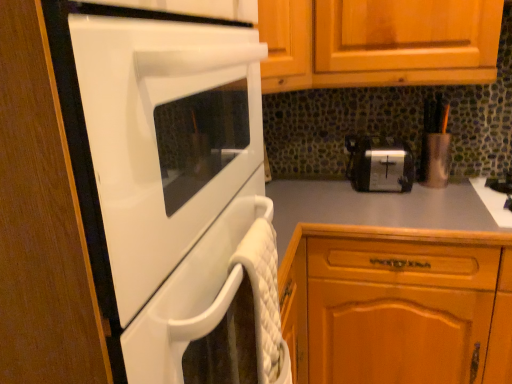
Question: Can you confirm if black matte gas stove at right is wider than white glossy oven at left?

Choices:
 (A) no
 (B) yes

Answer: (A)

Question: Does black matte gas stove at right have a smaller size compared to white glossy oven at left?

Choices:
 (A) no
 (B) yes

Answer: (B)

Question: Can you see black matte gas stove at right touching white glossy oven at left?

Choices:
 (A) no
 (B) yes

Answer: (A)

Question: Can you confirm if black matte gas stove at right is taller than white glossy oven at left?

Choices:
 (A) no
 (B) yes

Answer: (A)

Question: From a real-world perspective, is black matte gas stove at right on white glossy oven at left?

Choices:
 (A) no
 (B) yes

Answer: (A)

Question: Is white glossy oven at left surrounded by black matte gas stove at right?

Choices:
 (A) no
 (B) yes

Answer: (A)

Question: Is white glossy oven at left looking in the opposite direction of silver metallic toaster at center?

Choices:
 (A) yes
 (B) no

Answer: (B)

Question: Considering the relative positions of white glossy oven at left and silver metallic toaster at center in the image provided, is white glossy oven at left behind silver metallic toaster at center?

Choices:
 (A) yes
 (B) no

Answer: (B)

Question: Can you confirm if white glossy oven at left is wider than silver metallic toaster at center?

Choices:
 (A) yes
 (B) no

Answer: (A)

Question: From the image's perspective, is white glossy oven at left located beneath silver metallic toaster at center?

Choices:
 (A) no
 (B) yes

Answer: (B)

Question: Is white glossy oven at left taller than silver metallic toaster at center?

Choices:
 (A) no
 (B) yes

Answer: (B)

Question: Is white glossy oven at left to the left of silver metallic toaster at center from the viewer's perspective?

Choices:
 (A) no
 (B) yes

Answer: (B)

Question: Is black matte gas stove at right at the right side of wooden cabinet at lower right?

Choices:
 (A) no
 (B) yes

Answer: (B)